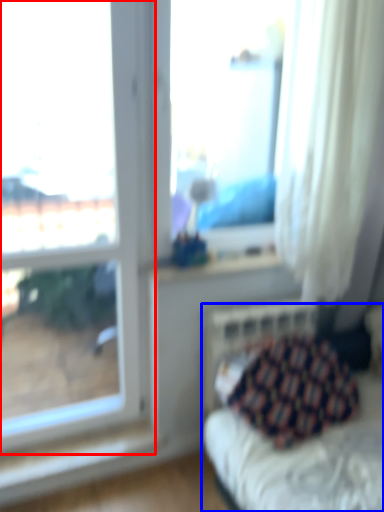
Question: Which point is closer to the camera, window (highlighted by a red box) or furniture (highlighted by a blue box)?

Choices:
 (A) window
 (B) furniture

Answer: (A)